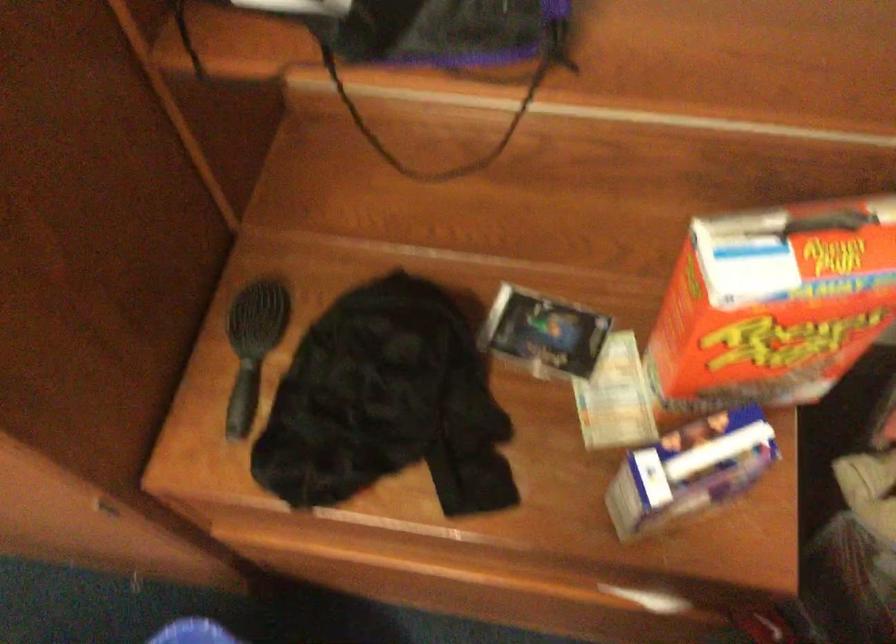
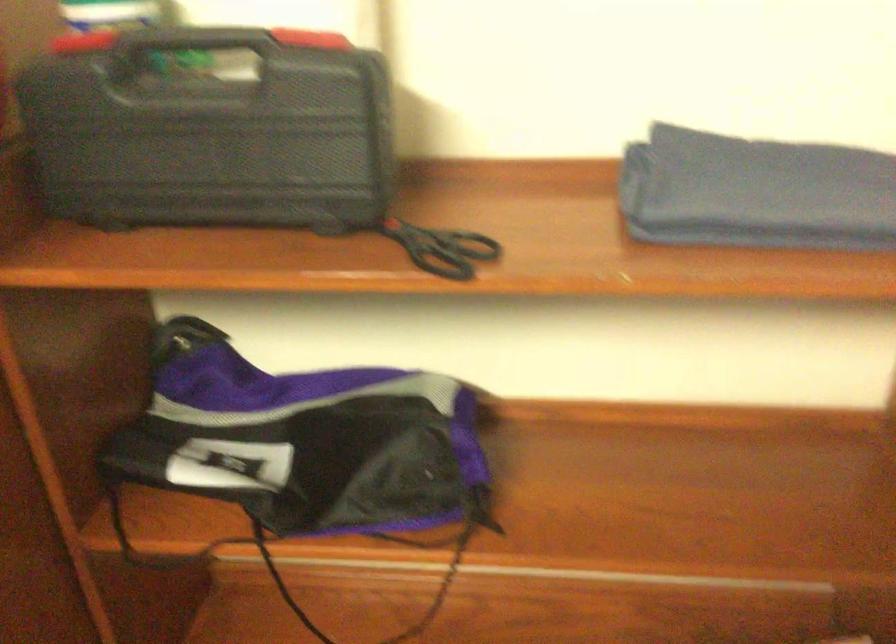
Question: The first image is from the beginning of the video and the second image is from the end. How did the camera likely rotate when shooting the video?

Choices:
 (A) Left
 (B) Right
 (C) Up
 (D) Down

Answer: (C)